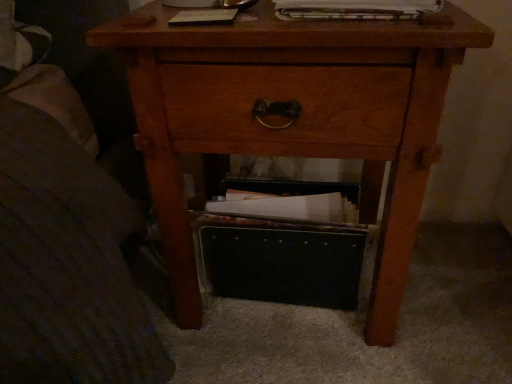
Question: Is printed paper magazine at upper center facing away from wooden nightstand at center?

Choices:
 (A) no
 (B) yes

Answer: (A)

Question: Are printed paper magazine at upper center and wooden nightstand at center far apart?

Choices:
 (A) yes
 (B) no

Answer: (B)

Question: Is printed paper magazine at upper center smaller than wooden nightstand at center?

Choices:
 (A) no
 (B) yes

Answer: (B)

Question: Can you confirm if printed paper magazine at upper center is shorter than wooden nightstand at center?

Choices:
 (A) no
 (B) yes

Answer: (B)

Question: From the image's perspective, would you say printed paper magazine at upper center is positioned over wooden nightstand at center?

Choices:
 (A) yes
 (B) no

Answer: (A)

Question: In terms of width, does printed paper magazine at upper center look wider or thinner when compared to wooden nightstand at center?

Choices:
 (A) wide
 (B) thin

Answer: (B)

Question: Based on their sizes in the image, would you say printed paper magazine at upper center is bigger or smaller than wooden nightstand at center?

Choices:
 (A) small
 (B) big

Answer: (A)

Question: Is printed paper magazine at upper center spatially inside wooden nightstand at center, or outside of it?

Choices:
 (A) outside
 (B) inside

Answer: (A)

Question: Relative to wooden nightstand at center, is printed paper magazine at upper center in front or behind?

Choices:
 (A) behind
 (B) front

Answer: (A)

Question: From a real-world perspective, is black leather shoe box at lower center positioned above or below printed paper magazine at upper center?

Choices:
 (A) above
 (B) below

Answer: (B)

Question: Visually, is black leather shoe box at lower center positioned to the left or to the right of printed paper magazine at upper center?

Choices:
 (A) left
 (B) right

Answer: (A)

Question: Considering the positions of black leather shoe box at lower center and printed paper magazine at upper center in the image, is black leather shoe box at lower center taller or shorter than printed paper magazine at upper center?

Choices:
 (A) tall
 (B) short

Answer: (A)

Question: Choose the correct answer: Is black leather shoe box at lower center inside printed paper magazine at upper center or outside it?

Choices:
 (A) outside
 (B) inside

Answer: (A)

Question: In the image, is printed paper magazine at upper center positioned in front of or behind black leather shoe box at lower center?

Choices:
 (A) behind
 (B) front

Answer: (B)

Question: In terms of size, does printed paper magazine at upper center appear bigger or smaller than black leather shoe box at lower center?

Choices:
 (A) big
 (B) small

Answer: (B)